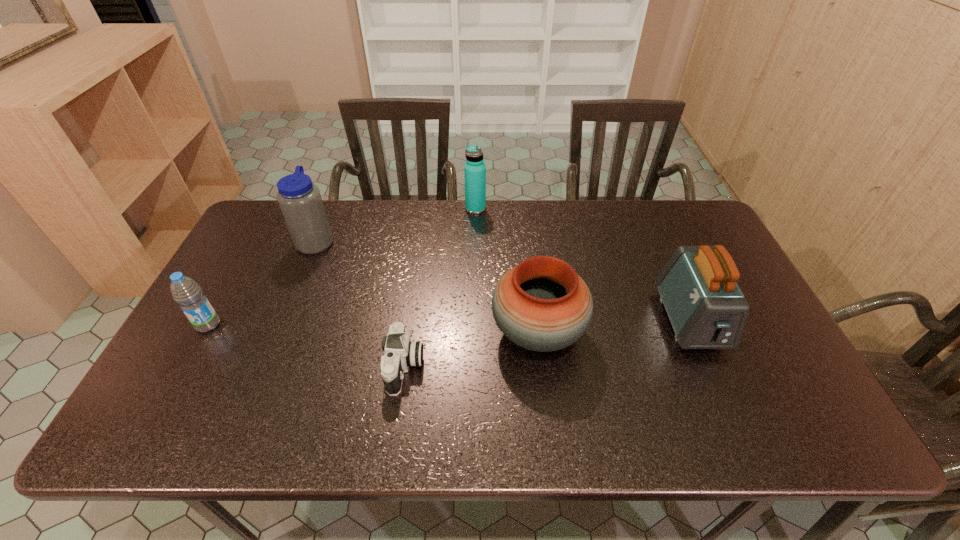
This screenshot has width=960, height=540. In order to click on vacant region at the left edge of the desktop in this screenshot , I will do `click(186, 341)`.

The image size is (960, 540). What are the coordinates of `vacant area at the far left corner` in the screenshot? It's located at (263, 218).

The image size is (960, 540). In the image, there is a desktop. What are the coordinates of `blank space at the far right corner` in the screenshot? It's located at (653, 199).

Locate an element on the screen. This screenshot has width=960, height=540. vacant space that is in between the shortest object and the leftmost water bottle is located at coordinates (306, 346).

Identify the location of free spot between the third object from left to right and the second water bottle from right to left. The image size is (960, 540). (360, 304).

Locate an element on the screen. free space between the leftmost object and the fourth object from left to right is located at coordinates (342, 267).

At what (x,y) coordinates should I click in order to perform the action: click on free spot between the second object from right to left and the toaster. Please return your answer as a coordinate pair (x, y). The image size is (960, 540). Looking at the image, I should click on (613, 326).

Find the location of a particular element. free point between the second object from right to left and the nearest water bottle is located at coordinates pos(372,328).

This screenshot has height=540, width=960. Identify the location of free space between the second farthest object and the farthest object. (396, 225).

Locate an element on the screen. free space between the leftmost object and the farthest object is located at coordinates (342, 267).